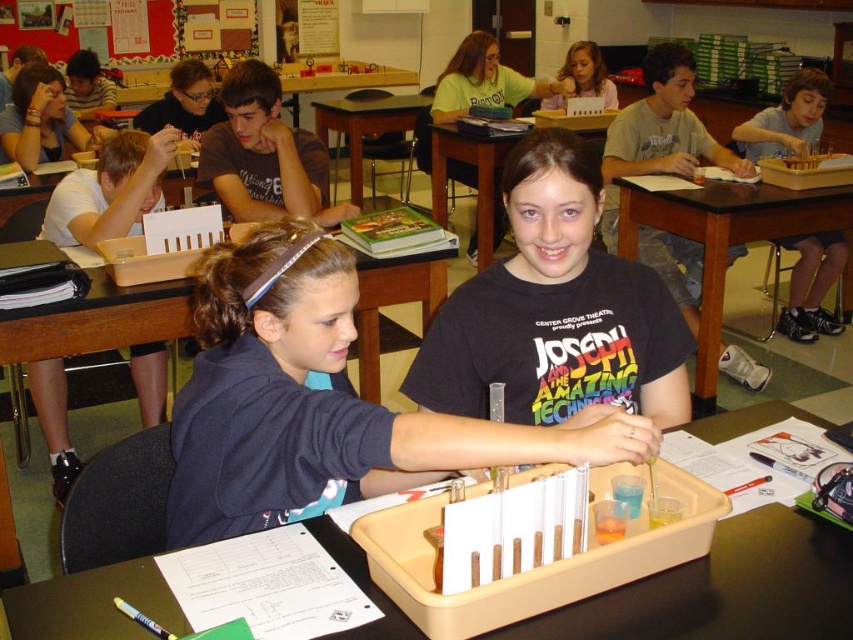
Does translucent plastic tray at center appear under translucent plastic test tubes at center?

Yes, translucent plastic tray at center is below translucent plastic test tubes at center.

Between point (666, 621) and point (453, 125), which one is positioned in front?

Positioned in front is point (666, 621).

Identify the location of translucent plastic tray at center. This screenshot has height=640, width=853. (724, 589).

Identify the location of translucent plastic tray at center. The height and width of the screenshot is (640, 853). (724, 589).

Is translucent plastic test tubes at center positioned before brown wooden table at center?

Yes, translucent plastic test tubes at center is closer to the viewer.

Is point (445, 138) positioned in front of point (421, 108)?

Yes, it is.

The height and width of the screenshot is (640, 853). What are the coordinates of `translucent plastic test tubes at center` in the screenshot? It's located at (471, 180).

Is point (451, 324) farther from camera compared to point (627, 609)?

Yes.

The height and width of the screenshot is (640, 853). What do you see at coordinates (555, 310) in the screenshot?
I see `black matte shirt at center` at bounding box center [555, 310].

Who is more distant from viewer, [505,364] or [380,598]?

The point [505,364] is behind.

Image resolution: width=853 pixels, height=640 pixels. Find the location of `black matte shirt at center`. black matte shirt at center is located at coordinates (555, 310).